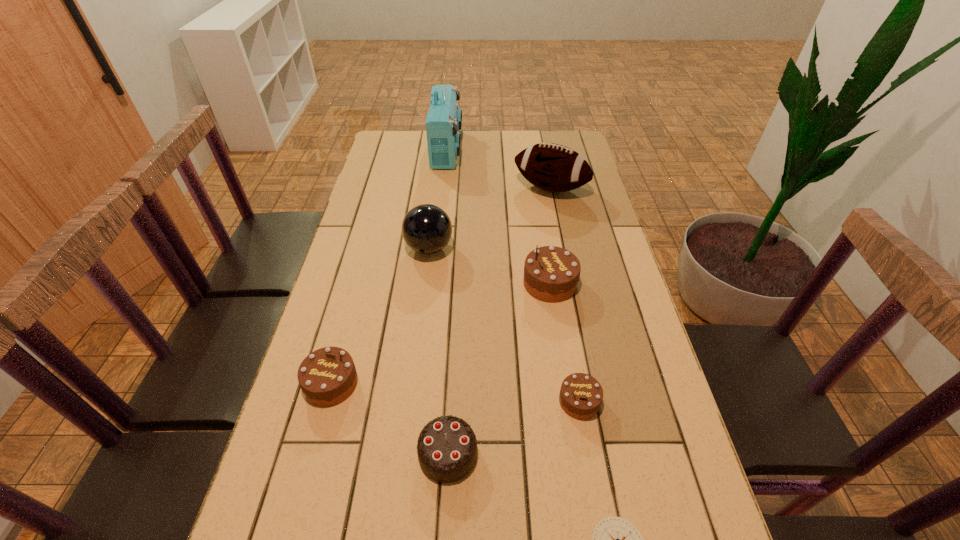
You are a GUI agent. You are given a task and a screenshot of the screen. Output one action in this format:
    pyautogui.click(x=<x>, y=<y>)
    Task: Click on the second chocolate cake from left to right
    The width and height of the screenshot is (960, 540).
    Given the screenshot: What is the action you would take?
    pyautogui.click(x=447, y=447)

Identify the location of the second shortest object. This screenshot has height=540, width=960. [581, 395].

Identify the location of the shortest chocolate cake. The height and width of the screenshot is (540, 960). (581, 395).

Where is `free space located on the front-facing side of the radio receiver`? free space located on the front-facing side of the radio receiver is located at coordinates (541, 149).

Locate an element on the screen. This screenshot has height=540, width=960. vacant position located 0.280m on the left of the football (American) is located at coordinates (435, 188).

Identify the location of free space located on the side of the bowling ball with the finger holes. The image size is (960, 540). (425, 277).

Find the location of `vacant space located on the left of the fourth tallest object`. vacant space located on the left of the fourth tallest object is located at coordinates (441, 284).

You are a GUI agent. You are given a task and a screenshot of the screen. Output one action in this format:
    pyautogui.click(x=<x>, y=<y>)
    Task: Click on the vacant region located 0.360m on the back of the leftmost object
    The height and width of the screenshot is (540, 960).
    Given the screenshot: What is the action you would take?
    pyautogui.click(x=366, y=259)

The height and width of the screenshot is (540, 960). Identify the location of vacant position located on the back of the nearest chocolate cake. (453, 362).

Locate an element on the screen. vacant space located 0.180m on the back of the seventh tallest object is located at coordinates (565, 322).